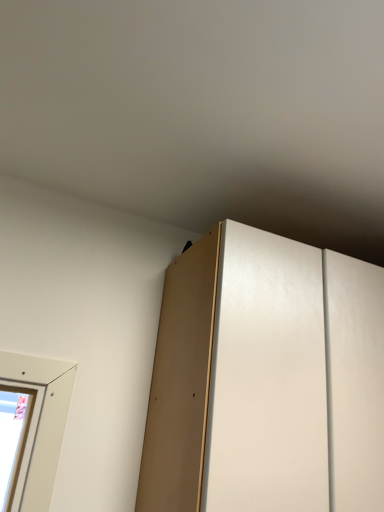
Locate an element on the screen. This screenshot has height=512, width=384. white glossy cupboard at upper right is located at coordinates (266, 379).

What do you see at coordinates (266, 379) in the screenshot? The width and height of the screenshot is (384, 512). I see `white glossy cupboard at upper right` at bounding box center [266, 379].

Locate an element on the screen. This screenshot has width=384, height=512. white glossy cupboard at upper right is located at coordinates (266, 379).